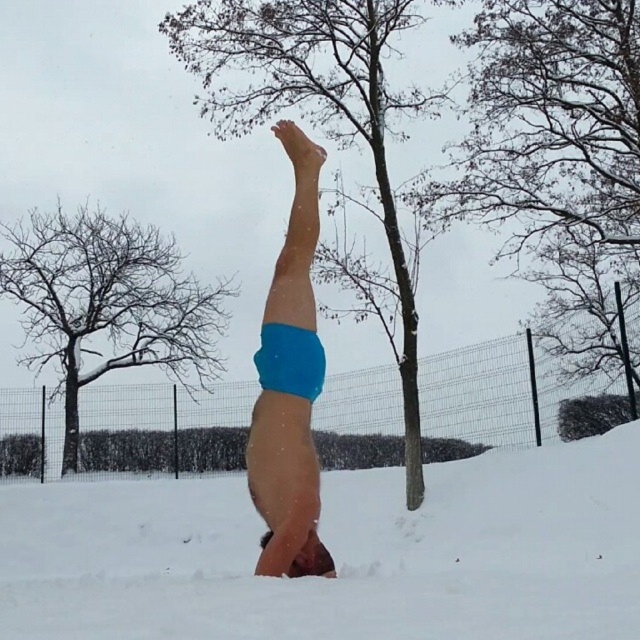
Question: Which point is closer to the camera?

Choices:
 (A) (292, 422)
 (B) (250, 605)

Answer: (B)

Question: Does white powdery snow at center have a lesser width compared to blue fabric shorts at center?

Choices:
 (A) no
 (B) yes

Answer: (A)

Question: Is white powdery snow at center to the left of blue fabric shorts at center from the viewer's perspective?

Choices:
 (A) no
 (B) yes

Answer: (B)

Question: Is white powdery snow at center bigger than blue fabric shorts at center?

Choices:
 (A) yes
 (B) no

Answer: (A)